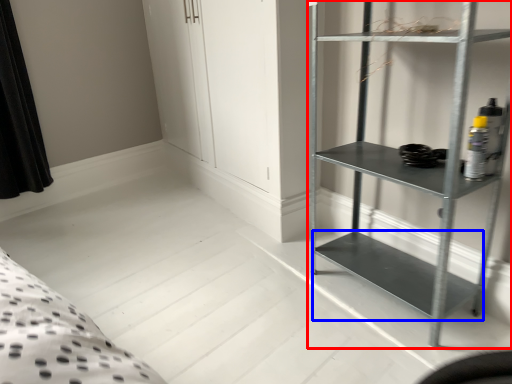
Question: Among these objects, which one is nearest to the camera, shelf (highlighted by a red box) or cabinet (highlighted by a blue box)?

Choices:
 (A) shelf
 (B) cabinet

Answer: (A)